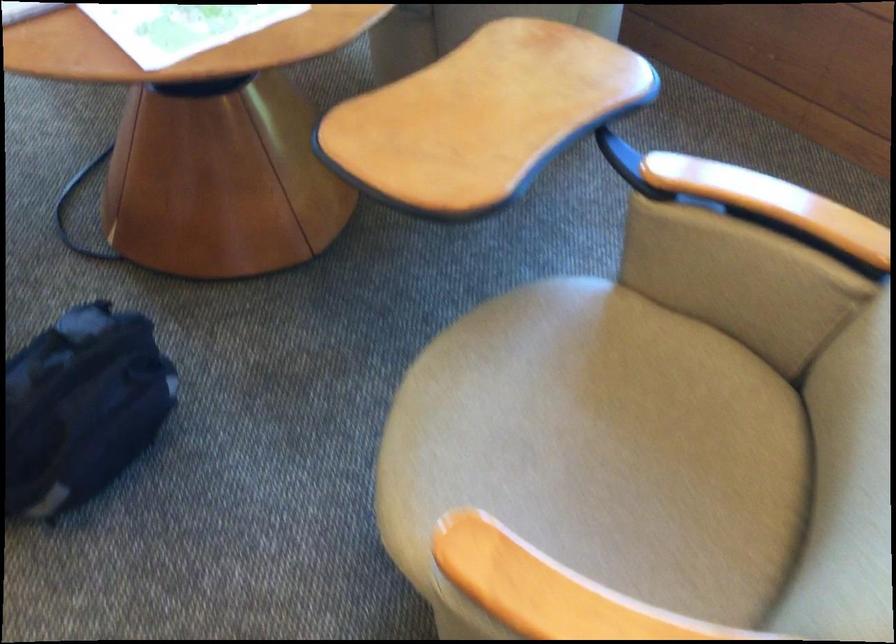
What do you see at coordinates (602, 448) in the screenshot? This screenshot has height=644, width=896. I see `a chair sitting surface` at bounding box center [602, 448].